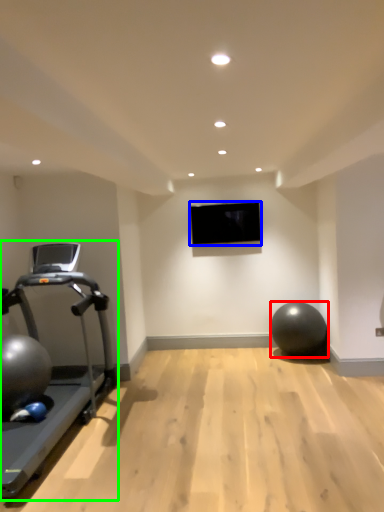
Question: Estimate the real-world distances between objects in this image. Which object is closer to ball (highlighted by a red box), projection screen (highlighted by a blue box) or treadmill (highlighted by a green box)?

Choices:
 (A) projection screen
 (B) treadmill

Answer: (A)